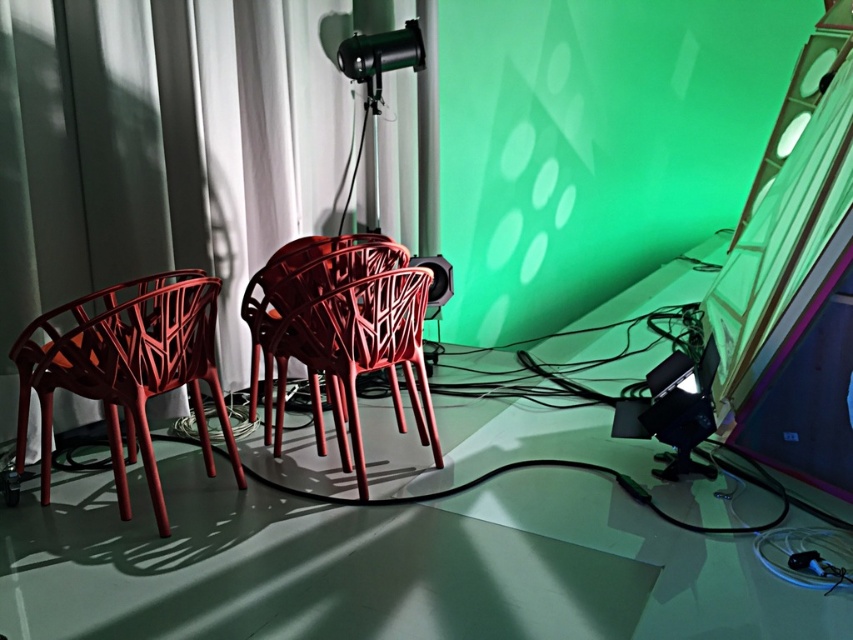
Who is more forward, (531, 406) or (114, 372)?

Point (114, 372)

Locate an element on the screen. This screenshot has height=640, width=853. transparent plastic table at center is located at coordinates (383, 564).

You are a GUI agent. You are given a task and a screenshot of the screen. Output one action in this format:
    pyautogui.click(x=<x>, y=<y>)
    Task: Click on the transparent plastic table at center
    
    Given the screenshot: What is the action you would take?
    pyautogui.click(x=383, y=564)

Does transparent plastic table at center have a lesser width compared to matte plastic chair at center?

In fact, transparent plastic table at center might be wider than matte plastic chair at center.

Who is more forward, (20, 520) or (384, 248)?

Point (20, 520) is more forward.

I want to click on transparent plastic table at center, so click(383, 564).

Which is more to the right, matte plastic chair at left or matte plastic chair at center?

From the viewer's perspective, matte plastic chair at center appears more on the right side.

Which is in front, point (212, 369) or point (300, 250)?

Point (212, 369) is in front.

Locate an element on the screen. The height and width of the screenshot is (640, 853). matte plastic chair at left is located at coordinates (126, 369).